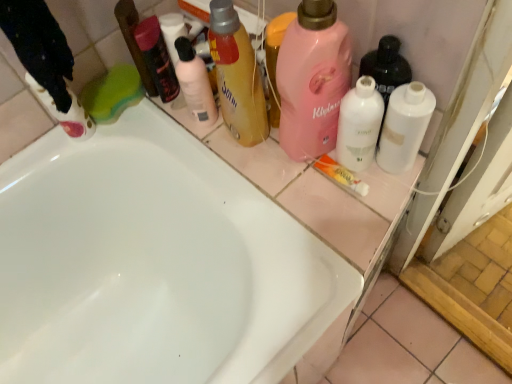
Question: Visually, is green sponge at upper left, which appears as the second cleaning product when viewed from the left, positioned to the left or to the right of white glossy bathtub at center?

Choices:
 (A) right
 (B) left

Answer: (B)

Question: Is green sponge at upper left, which is the 6th cleaning product from right to left, spatially inside white glossy bathtub at center, or outside of it?

Choices:
 (A) inside
 (B) outside

Answer: (B)

Question: Which of these objects is positioned closest to the translucent yellow bottle at upper center, the 4th cleaning product from the left?

Choices:
 (A) green sponge at upper left, which appears as the second cleaning product when viewed from the left
 (B) pink matte liquid at upper center, which is the fifth cleaning product from left to right
 (C) white glossy bottle at center, which appears as the 6th cleaning product when viewed from the left
 (D) matte white cleaning product at left, placed as the 1th cleaning product when sorted from left to right
 (E) matte black mouthwash at upper center

Answer: (B)

Question: Based on their relative distances, which object is farther from the matte pink bottle at upper center, which is the 5th cleaning product from right to left?

Choices:
 (A) white glossy toothpaste at center
 (B) white glossy bottle at center, which appears as the 6th cleaning product when viewed from the left
 (C) green sponge at upper left, which appears as the second cleaning product when viewed from the left
 (D) matte black mouthwash at upper center
 (E) translucent yellow bottle at upper center, the 4th cleaning product from the left

Answer: (B)